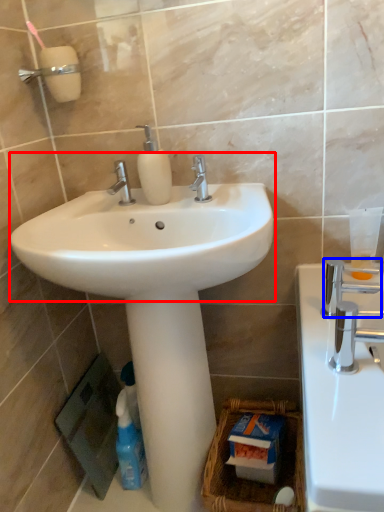
Question: Among these objects, which one is farthest to the camera, sink (highlighted by a red box) or plumbing fixture (highlighted by a blue box)?

Choices:
 (A) sink
 (B) plumbing fixture

Answer: (B)